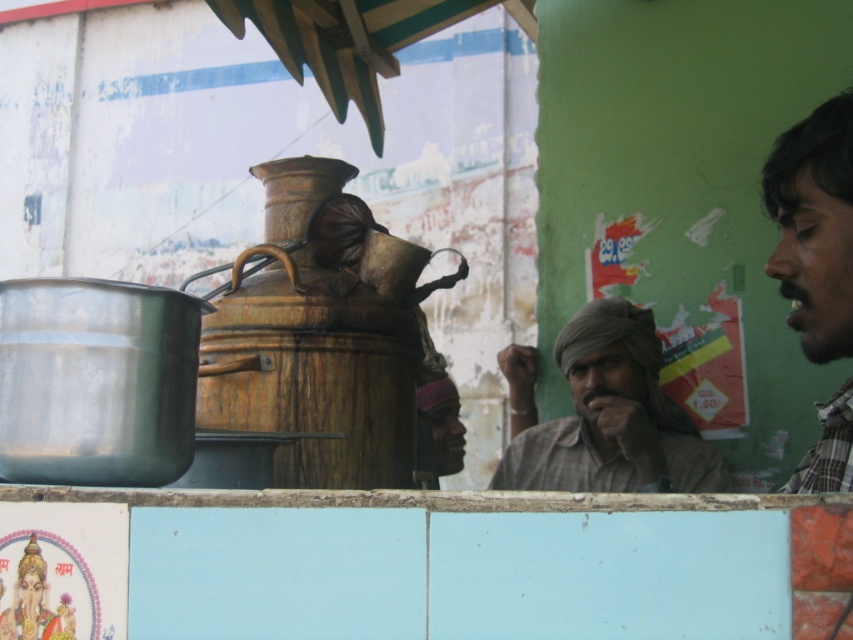
Question: Which point is farther from the camera taking this photo?

Choices:
 (A) (637, 378)
 (B) (807, 488)

Answer: (A)

Question: From the image, what is the correct spatial relationship of brown textured shirt at center in relation to dark brown plaid shirt at right?

Choices:
 (A) above
 (B) below

Answer: (B)

Question: Is brown textured shirt at center thinner than dark brown plaid shirt at right?

Choices:
 (A) no
 (B) yes

Answer: (A)

Question: Which point is farther to the camera?

Choices:
 (A) (842, 292)
 (B) (595, 346)

Answer: (B)

Question: Can you confirm if brown textured shirt at center is thinner than dark brown plaid shirt at right?

Choices:
 (A) no
 (B) yes

Answer: (A)